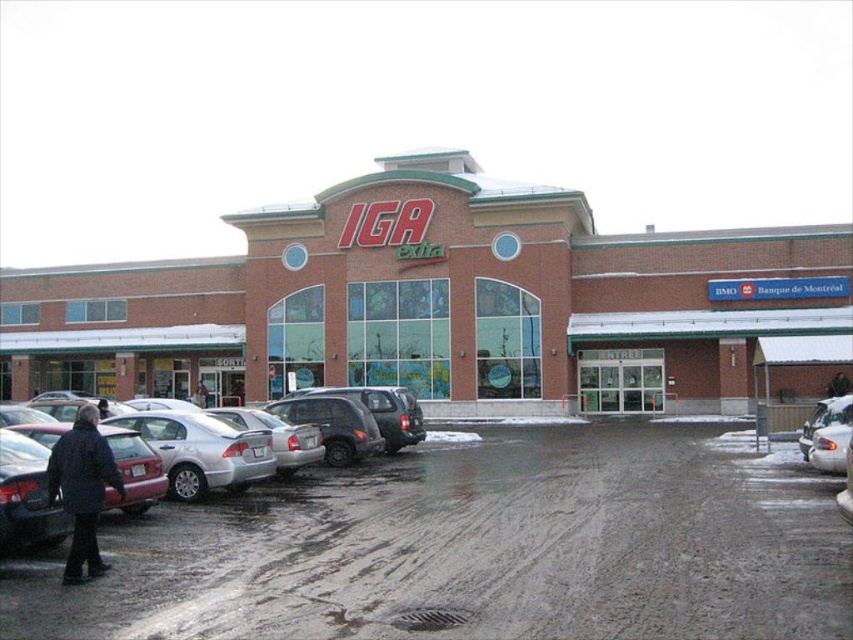
Does point (323, 378) come in front of point (453, 449)?

No, it is not.

Is point (492, 378) positioned in front of point (785, 483)?

No, it is behind (785, 483).

At what (x,y) coordinates should I click in order to perform the action: click on brown brick building at center. Please return your answer as a coordinate pair (x, y). The image size is (853, 640). Looking at the image, I should click on (440, 304).

Who is positioned more to the right, dark blue jacket at lower left or silver metallic sedan at lower right?

Positioned to the right is silver metallic sedan at lower right.

Is point (103, 563) less distant than point (833, 419)?

Yes, it is.

You are a GUI agent. You are given a task and a screenshot of the screen. Output one action in this format:
    pyautogui.click(x=<x>, y=<y>)
    Task: Click on the dark blue jacket at lower left
    The height and width of the screenshot is (640, 853).
    Given the screenshot: What is the action you would take?
    pyautogui.click(x=82, y=490)

You are a GUI agent. You are given a task and a screenshot of the screen. Output one action in this format:
    pyautogui.click(x=<x>, y=<y>)
    Task: Click on the dark blue jacket at lower left
    The width and height of the screenshot is (853, 640).
    Given the screenshot: What is the action you would take?
    pyautogui.click(x=82, y=490)

Is dark gray asphalt parking lot at lower center behind dark blue jacket at lower left?

No, dark gray asphalt parking lot at lower center is closer to the viewer.

Is dark gray asphalt parking lot at lower center above dark blue jacket at lower left?

No, dark gray asphalt parking lot at lower center is not above dark blue jacket at lower left.

Is point (149, 561) closer to camera compared to point (96, 492)?

No.

The image size is (853, 640). What are the coordinates of `dark gray asphalt parking lot at lower center` in the screenshot? It's located at (477, 548).